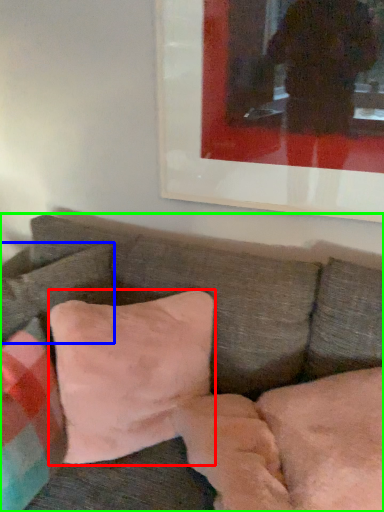
Question: Estimate the real-world distances between objects in this image. Which object is closer to pillow (highlighted by a red box), pillow (highlighted by a blue box) or studio couch (highlighted by a green box)?

Choices:
 (A) pillow
 (B) studio couch

Answer: (B)